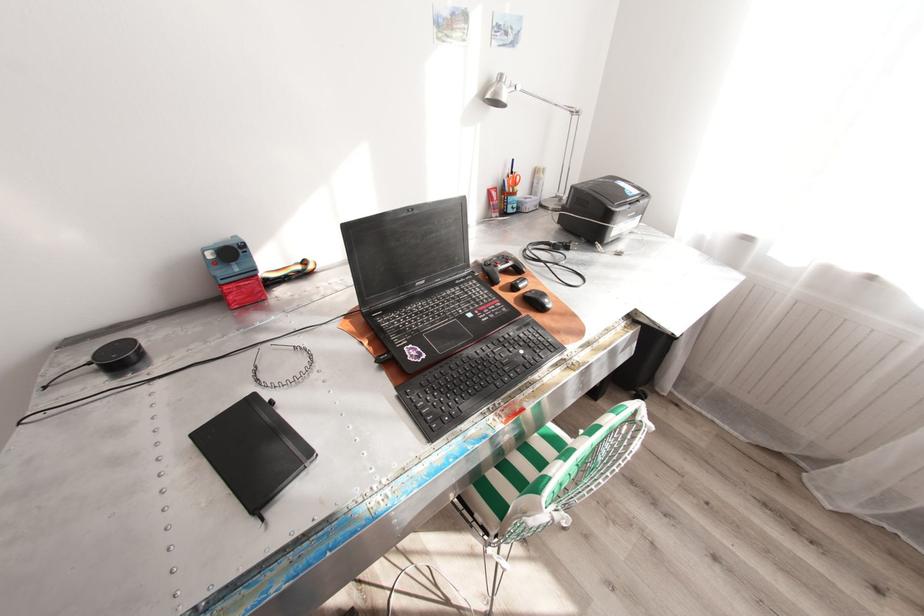
The location [234,272] corresponds to which object?

This point indicates the red tube.